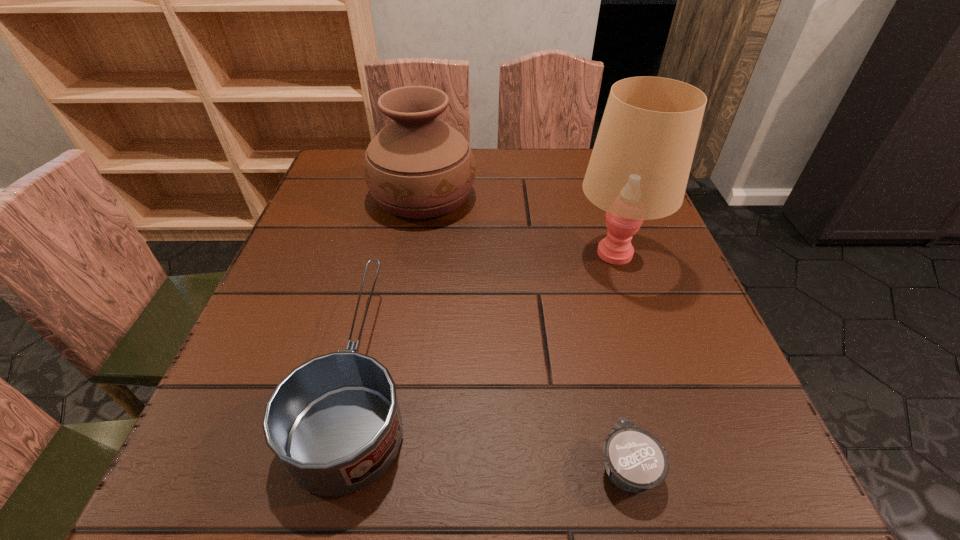
Identify the location of vacant point at the far edge. The image size is (960, 540). (487, 161).

In the image, there is a desktop. In order to click on vacant space at the near edge in this screenshot , I will do `click(543, 462)`.

This screenshot has height=540, width=960. In the image, there is a desktop. In order to click on free space at the left edge in this screenshot , I will do `click(250, 333)`.

This screenshot has height=540, width=960. In the image, there is a desktop. Identify the location of vacant space at the right edge. (679, 380).

I want to click on free space at the far left corner, so click(x=344, y=185).

Locate an element on the screen. The height and width of the screenshot is (540, 960). empty location between the lampshade and the second tallest object is located at coordinates (519, 224).

Identify the location of empty space that is in between the lampshade and the saucepan. This screenshot has width=960, height=540. (488, 313).

This screenshot has width=960, height=540. I want to click on free space between the second tallest object and the tallest object, so click(519, 224).

Image resolution: width=960 pixels, height=540 pixels. I want to click on free area in between the second tallest object and the shortest object, so pyautogui.click(x=525, y=331).

Locate an element on the screen. The width and height of the screenshot is (960, 540). empty location between the tallest object and the yogurt is located at coordinates (621, 359).